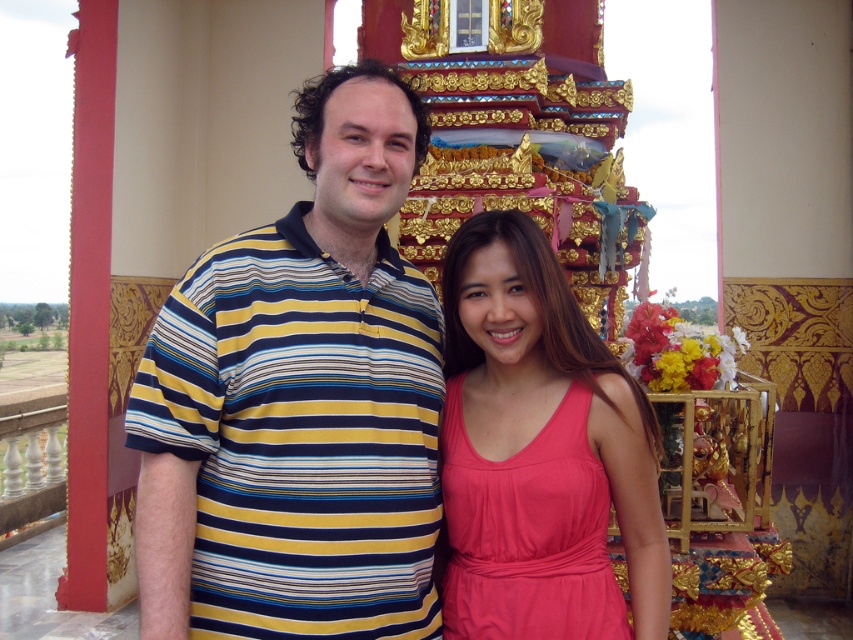
You are a photographer setting up for a group photo. You need to ensure that both the striped cotton shirt at center and the pink satin dress at center are visible in the frame. Given their heights, which clothing item might you need to adjust the camera angle to better capture?

The striped cotton shirt at center is taller than the pink satin dress at center. To ensure both are visible, you might need to lower the camera angle slightly to include the full height of the striped cotton shirt at center while still capturing the pink satin dress at center.

You are a photographer trying to capture both the striped cotton shirt at center and the pink satin dress at center in a single frame. Based on their sizes, which one should you focus on to ensure both are clearly visible?

Since the striped cotton shirt at center is larger than the pink satin dress at center, you should focus on the striped cotton shirt at center to ensure both are clearly visible in the frame.